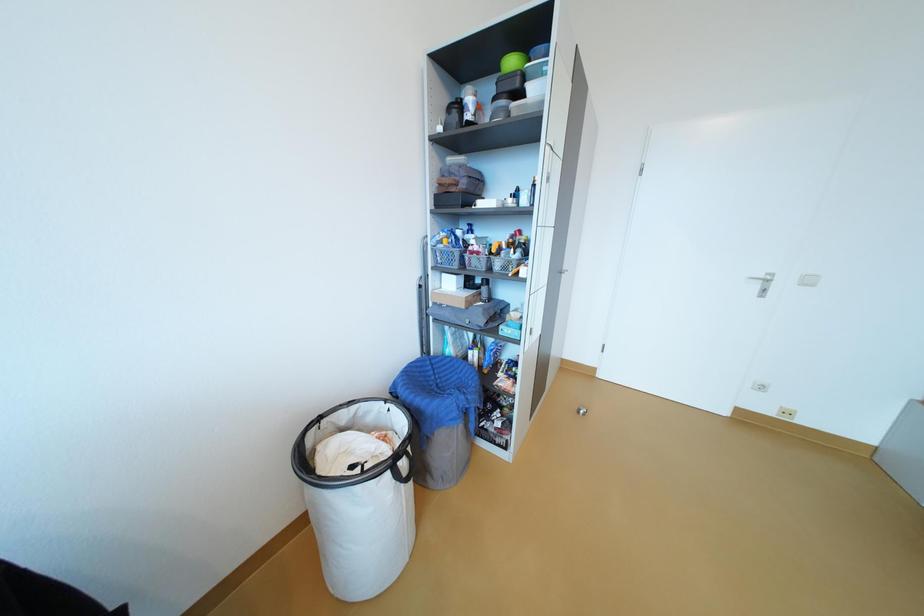
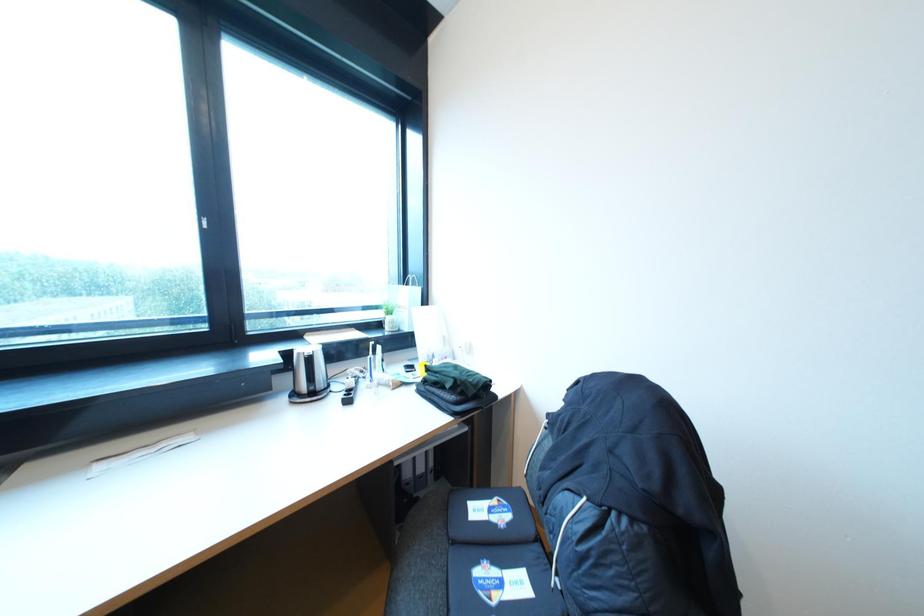
Question: How did the camera likely rotate?

Choices:
 (A) Left
 (B) Right
 (C) Up
 (D) Down

Answer: (A)